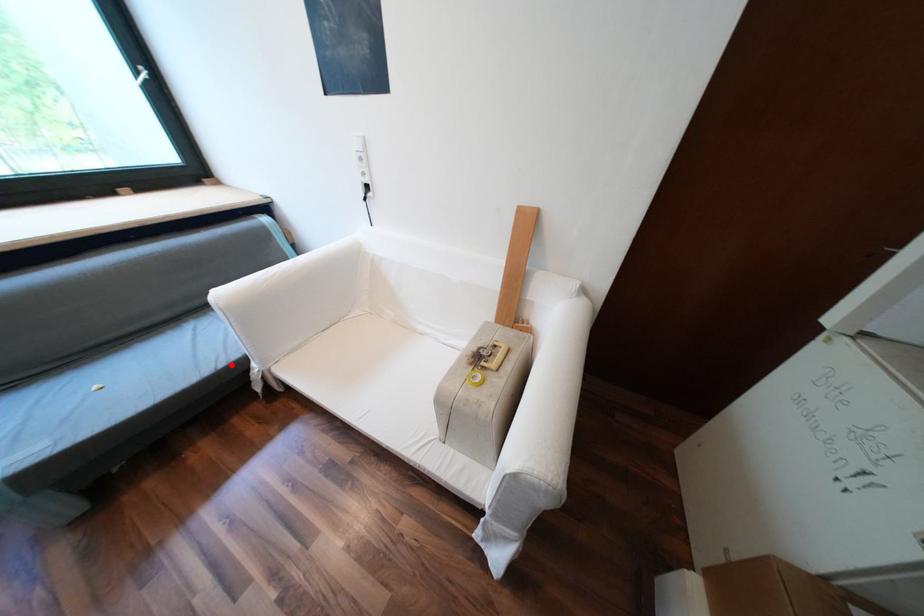
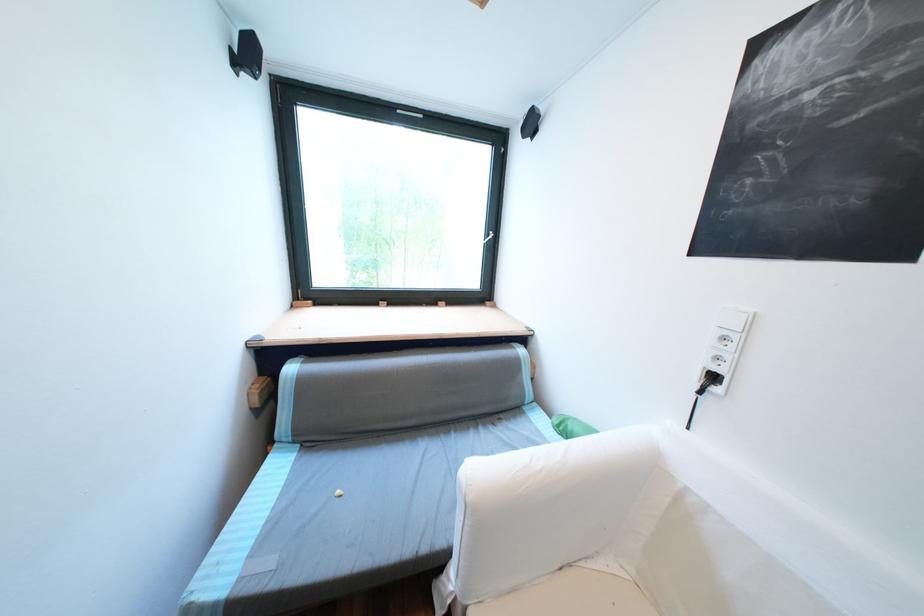
Find the pixel in the second image that matches the highlighted location in the first image.

(433, 549)